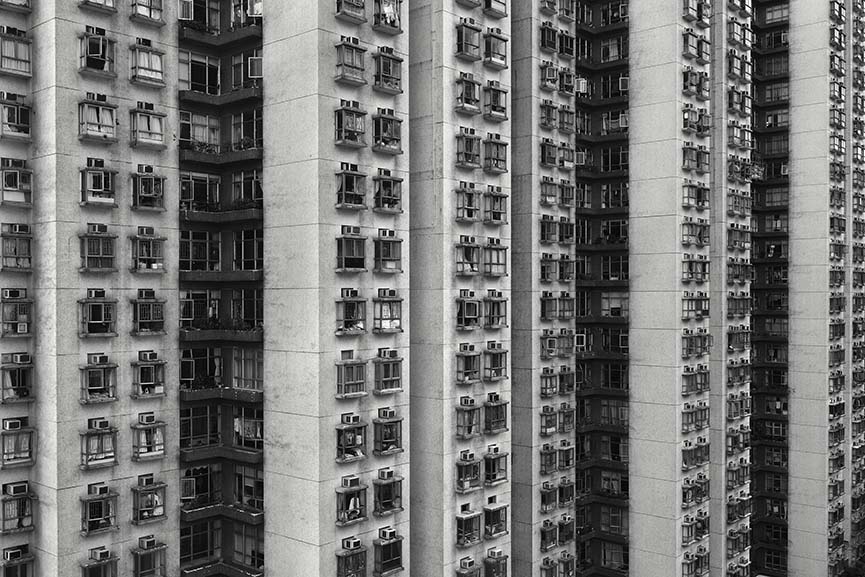
Locate an element on the screen. left wall opening absent an air conditioning unit is located at coordinates (465, 509).